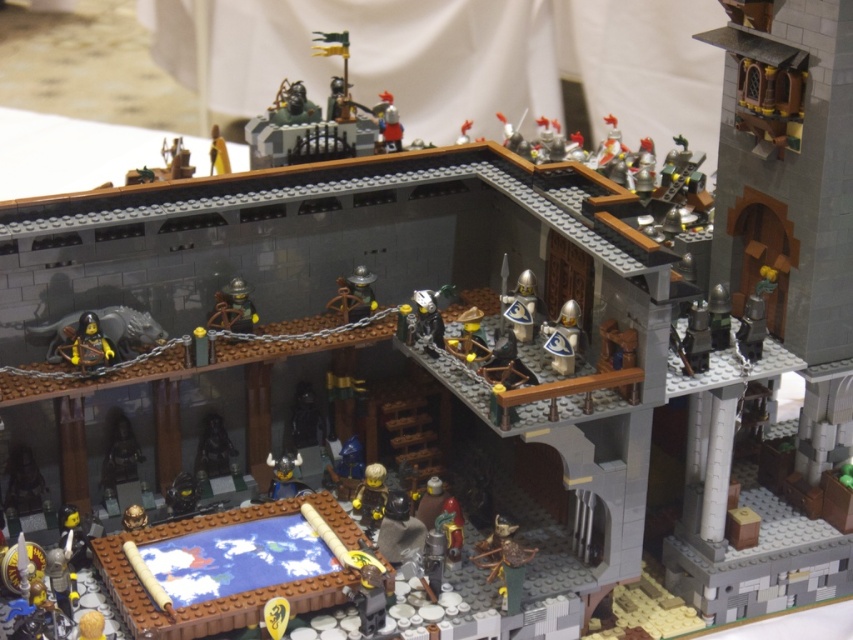
The image size is (853, 640). What are the coordinates of `shiny black minifigure at left` in the screenshot? It's located at (88, 346).

Image resolution: width=853 pixels, height=640 pixels. Identify the location of shiny black minifigure at left. (88, 346).

Does matte black knight at center appear on the right side of shiny silver helmet at center?

No, matte black knight at center is not to the right of shiny silver helmet at center.

Can you confirm if matte black knight at center is thinner than shiny silver helmet at center?

No, matte black knight at center is not thinner than shiny silver helmet at center.

Where is `matte black knight at center`? This screenshot has width=853, height=640. matte black knight at center is located at coordinates (213, 448).

Is point (90, 349) positioned before point (213, 426)?

Yes, point (90, 349) is closer to viewer.

Is shiny black minifigure at left smaller than matte black knight at center?

No.

The height and width of the screenshot is (640, 853). Find the location of `shiny black minifigure at left`. shiny black minifigure at left is located at coordinates (88, 346).